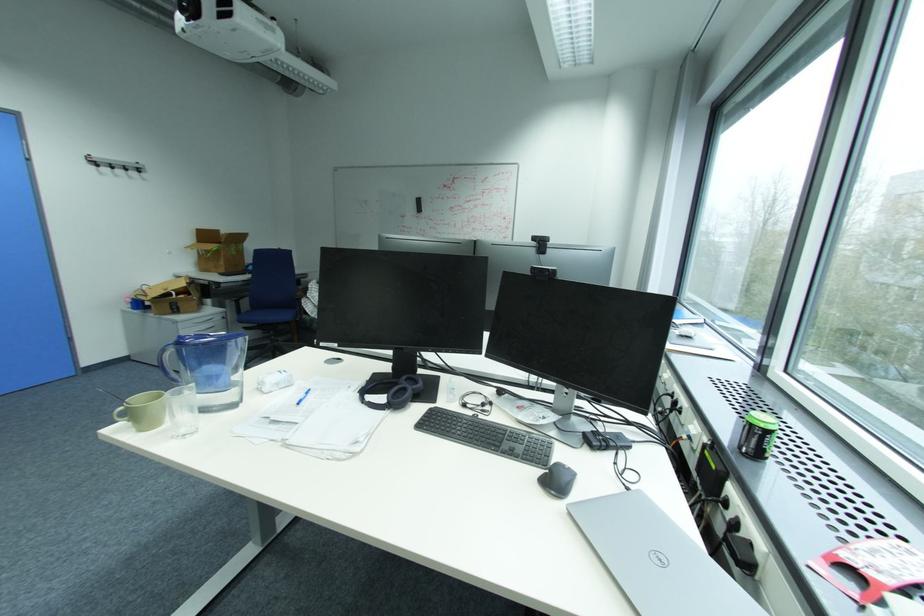
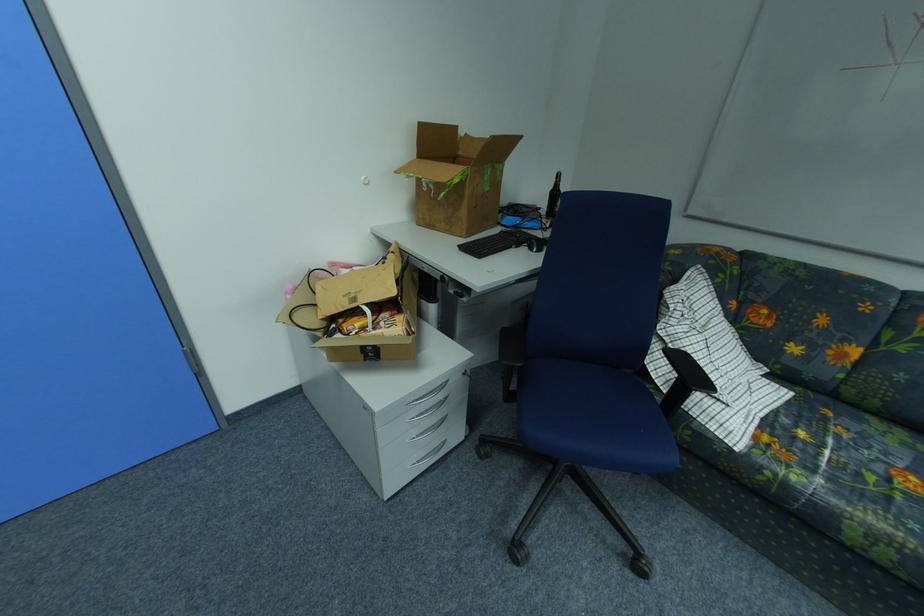
The point at (231, 264) is marked in the first image. Where is the corresponding point in the second image?

(470, 214)